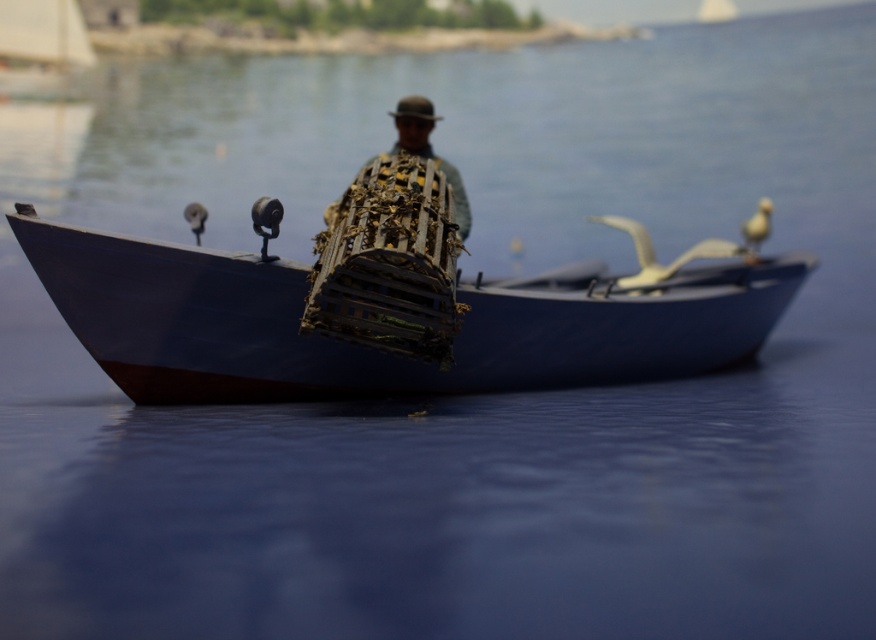
The width and height of the screenshot is (876, 640). What do you see at coordinates (378, 348) in the screenshot? I see `metallic blue boat at center` at bounding box center [378, 348].

Is metallic blue boat at center positioned behind white feathered bird at center?

No, it is in front of white feathered bird at center.

Which is in front, point (385, 352) or point (743, 248)?

Point (385, 352) is in front.

Locate an element on the screen. The width and height of the screenshot is (876, 640). metallic blue boat at center is located at coordinates (378, 348).

Does metallic blue boat at center have a greater width compared to matte black bird at center?

Correct, the width of metallic blue boat at center exceeds that of matte black bird at center.

Does point (235, 298) come in front of point (194, 205)?

Yes.

What do you see at coordinates (378, 348) in the screenshot? I see `metallic blue boat at center` at bounding box center [378, 348].

The height and width of the screenshot is (640, 876). In order to click on metallic blue boat at center in this screenshot , I will do `click(378, 348)`.

Which is behind, point (759, 241) or point (202, 209)?

The point (759, 241) is more distant.

In the scene shown: Who is more forward, (763, 205) or (198, 227)?

Positioned in front is point (198, 227).

Does point (767, 220) come farther from viewer compared to point (196, 205)?

Yes, point (767, 220) is farther from viewer.

At what (x,y) coordinates should I click in order to perform the action: click on white feathered bird at upper right. Please return your answer as a coordinate pair (x, y). Looking at the image, I should click on pos(757,225).